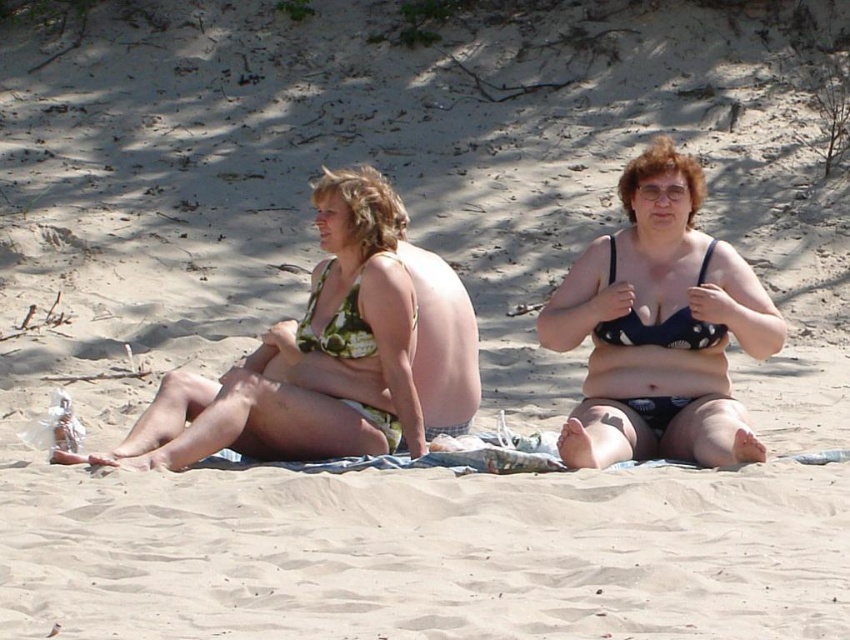
Can you confirm if matte black bikini top at center is taller than green floral bikini at left?

Yes.

Between matte black bikini top at center and green floral bikini at left, which one is positioned lower?

green floral bikini at left

Who is more forward, (615, 384) or (200, 381)?

Point (200, 381) is more forward.

Image resolution: width=850 pixels, height=640 pixels. In order to click on matte black bikini top at center in this screenshot , I will do `click(659, 326)`.

Is green floral bikini at left smaller than green floral bikini top at center?

Actually, green floral bikini at left might be larger than green floral bikini top at center.

Does green floral bikini at left lie behind green floral bikini top at center?

No, green floral bikini at left is closer to the viewer.

This screenshot has width=850, height=640. I want to click on green floral bikini at left, so click(x=306, y=356).

Does point (622, 420) come in front of point (320, 291)?

Yes, point (622, 420) is in front of point (320, 291).

The width and height of the screenshot is (850, 640). Describe the element at coordinates (659, 326) in the screenshot. I see `matte black bikini top at center` at that location.

Find the location of a particular element. The image size is (850, 640). matte black bikini top at center is located at coordinates (659, 326).